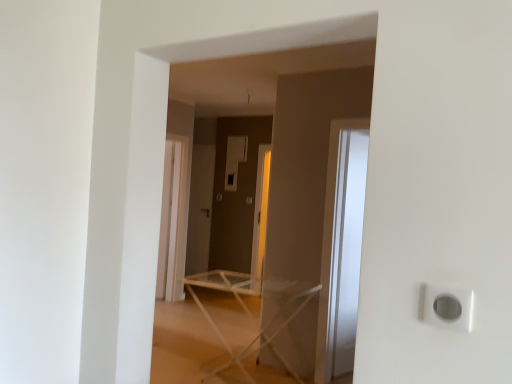
Question: Is white plastic ironing board at center positioned before matte gray screen door at center?

Choices:
 (A) no
 (B) yes

Answer: (B)

Question: Can matte gray screen door at center be found inside white plastic ironing board at center?

Choices:
 (A) no
 (B) yes

Answer: (A)

Question: Is white plastic ironing board at center smaller than matte gray screen door at center?

Choices:
 (A) no
 (B) yes

Answer: (A)

Question: Does white plastic ironing board at center have a lesser height compared to matte gray screen door at center?

Choices:
 (A) no
 (B) yes

Answer: (B)

Question: Is the depth of white plastic ironing board at center greater than that of matte gray screen door at center?

Choices:
 (A) no
 (B) yes

Answer: (A)

Question: From a real-world perspective, is white plastic outlet at lower right physically located above or below white plastic ironing board at center?

Choices:
 (A) above
 (B) below

Answer: (A)

Question: Considering the positions of white plastic outlet at lower right and white plastic ironing board at center in the image, is white plastic outlet at lower right taller or shorter than white plastic ironing board at center?

Choices:
 (A) short
 (B) tall

Answer: (A)

Question: Is point (428, 296) closer or farther from the camera than point (238, 355)?

Choices:
 (A) farther
 (B) closer

Answer: (B)

Question: Is white plastic outlet at lower right to the left or to the right of white plastic ironing board at center in the image?

Choices:
 (A) left
 (B) right

Answer: (B)

Question: Considering the positions of white plastic outlet at lower right and transparent glass door at right in the image, is white plastic outlet at lower right bigger or smaller than transparent glass door at right?

Choices:
 (A) big
 (B) small

Answer: (B)

Question: From the image's perspective, is white plastic outlet at lower right located above or below transparent glass door at right?

Choices:
 (A) below
 (B) above

Answer: (B)

Question: From a real-world perspective, is white plastic outlet at lower right positioned above or below transparent glass door at right?

Choices:
 (A) below
 (B) above

Answer: (B)

Question: Does point (470, 311) appear closer or farther from the camera than point (339, 347)?

Choices:
 (A) farther
 (B) closer

Answer: (B)

Question: Is matte gray screen door at center taller or shorter than white plastic ironing board at center?

Choices:
 (A) tall
 (B) short

Answer: (A)

Question: Is point (207, 226) positioned closer to the camera than point (297, 296)?

Choices:
 (A) closer
 (B) farther

Answer: (B)